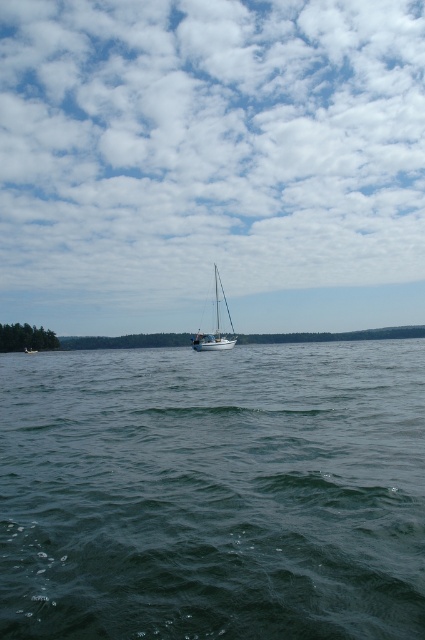
Question: Which object appears farthest from the camera in this image?

Choices:
 (A) white fluffy cloud at upper center
 (B) dark blue water at center

Answer: (A)

Question: Which point is farther to the camera?

Choices:
 (A) (201, 337)
 (B) (357, 600)
 (C) (36, 349)
 (D) (56, 292)

Answer: (D)

Question: Observing the image, what is the correct spatial positioning of white fluffy cloud at upper center in reference to dark blue water at center?

Choices:
 (A) right
 (B) left

Answer: (A)

Question: Which point is closer to the camera?

Choices:
 (A) dark blue water at center
 (B) white glossy sailboat at center

Answer: (A)

Question: Does white fluffy cloud at upper center have a lesser width compared to white sailboat at center?

Choices:
 (A) yes
 (B) no

Answer: (B)

Question: Observing the image, what is the correct spatial positioning of dark blue water at center in reference to white sailboat at center?

Choices:
 (A) above
 (B) below

Answer: (A)